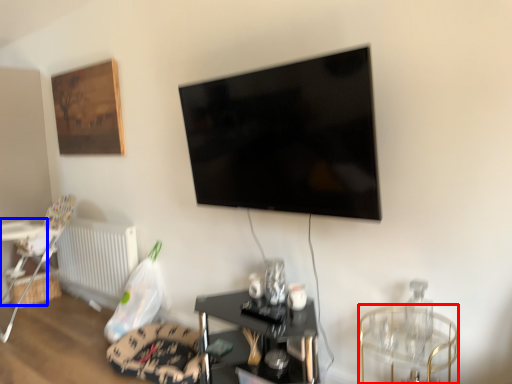
Question: Which object is closer to the camera taking this photo, glass table (highlighted by a red box) or table (highlighted by a blue box)?

Choices:
 (A) glass table
 (B) table

Answer: (A)